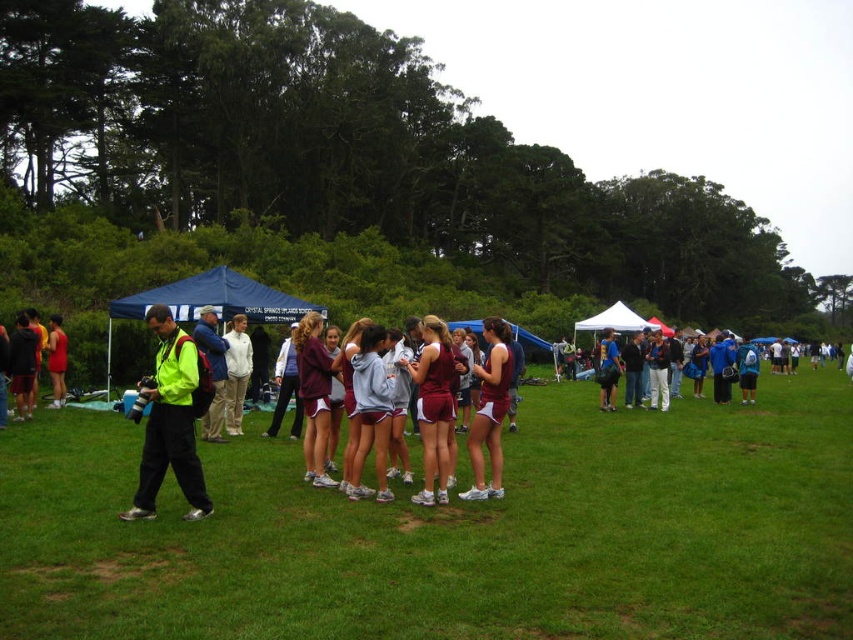
Is green grass at center bigger than white cotton hoodie at center?

Indeed, green grass at center has a larger size compared to white cotton hoodie at center.

Which is below, green grass at center or white cotton hoodie at center?

Positioned lower is green grass at center.

What do you see at coordinates (454, 532) in the screenshot? The height and width of the screenshot is (640, 853). I see `green grass at center` at bounding box center [454, 532].

Locate an element on the screen. The width and height of the screenshot is (853, 640). green grass at center is located at coordinates (454, 532).

Who is lower down, white cotton hoodie at center or matte green jacket at left?

white cotton hoodie at center is below.

Between white cotton hoodie at center and matte green jacket at left, which one has less height?

Standing shorter between the two is matte green jacket at left.

Is point (236, 358) closer to camera compared to point (67, 342)?

That is True.

Locate an element on the screen. This screenshot has width=853, height=640. white cotton hoodie at center is located at coordinates (236, 372).

Is green grass at center smaller than maroon jersey at center?

No, green grass at center is not smaller than maroon jersey at center.

Based on the photo, can you confirm if green grass at center is positioned above maroon jersey at center?

Actually, green grass at center is below maroon jersey at center.

This screenshot has width=853, height=640. I want to click on green grass at center, so click(x=454, y=532).